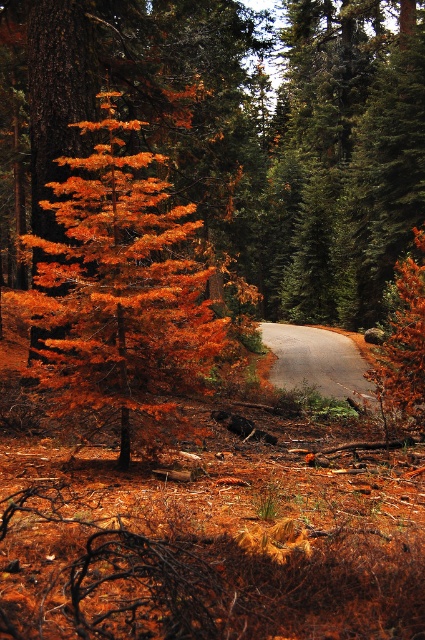
Question: Observing the image, what is the correct spatial positioning of orange matte tree at center in reference to gray asphalt road at center?

Choices:
 (A) above
 (B) below

Answer: (A)

Question: Which point is closer to the camera?

Choices:
 (A) gray asphalt road at center
 (B) orange matte tree at center

Answer: (B)

Question: Is orange matte tree at center thinner than gray asphalt road at center?

Choices:
 (A) yes
 (B) no

Answer: (A)

Question: From the image, what is the correct spatial relationship of orange matte tree at center in relation to gray asphalt road at center?

Choices:
 (A) right
 (B) left

Answer: (B)